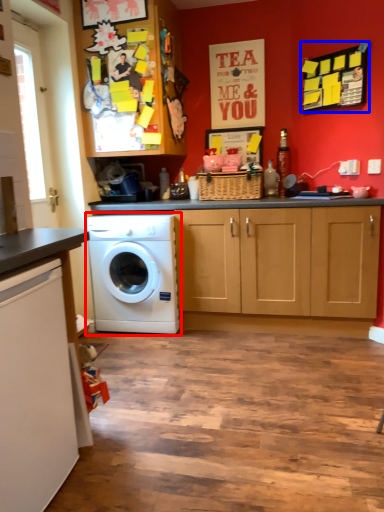
Question: Which object appears farthest to the camera in this image, washing machine (highlighted by a red box) or bulletin board (highlighted by a blue box)?

Choices:
 (A) washing machine
 (B) bulletin board

Answer: (A)